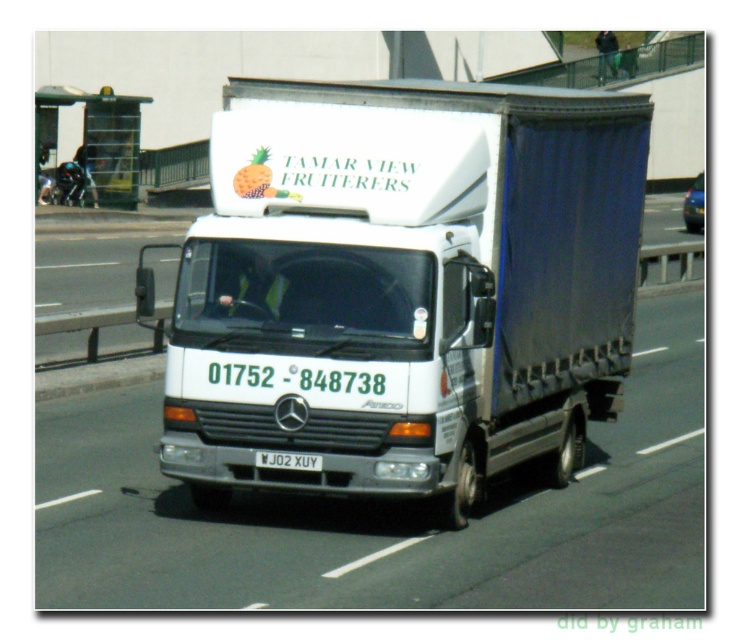
You are a pedestrian standing on the sidewalk and see both the white matte truck at center and the metallic blue taxi at center driving in the same direction. Which one is closer to the left edge of the road?

The white matte truck at center is closer to the left edge of the road because it is positioned to the left of the metallic blue taxi at center.

You are a pedestrian standing at point (696, 173) and want to cross the road to reach point (303, 467). Is the path between these two points clear of any obstacles?

The path between point (696, 173) and point (303, 467) is clear because point (303, 467) is in front of point (696, 173), indicating no obstacles are blocking the way.